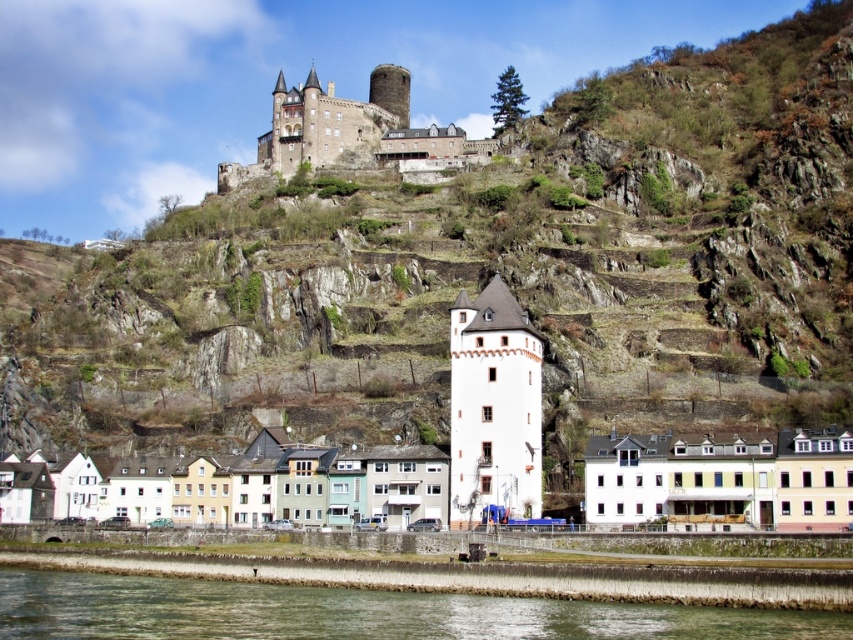
Between clear water at lower center and white matte building at lower center, which one appears on the left side from the viewer's perspective?

Positioned to the left is clear water at lower center.

How much distance is there between clear water at lower center and white matte building at lower center?

17.28 meters

Between point (90, 589) and point (839, 481), which one is positioned in front?

Point (90, 589) is more forward.

What are the coordinates of `clear water at lower center` in the screenshot? It's located at (357, 612).

Can you confirm if white matte building at lower center is wider than stone castle at upper center?

Yes, white matte building at lower center is wider than stone castle at upper center.

The height and width of the screenshot is (640, 853). What do you see at coordinates (721, 480) in the screenshot?
I see `white matte building at lower center` at bounding box center [721, 480].

Between point (670, 484) and point (328, 163), which one is positioned behind?

Positioned behind is point (328, 163).

In order to click on white matte building at lower center in this screenshot , I will do `click(721, 480)`.

Is brown rocky hillside at upper center above clear water at lower center?

Yes.

Can you confirm if brown rocky hillside at upper center is thinner than clear water at lower center?

No, brown rocky hillside at upper center is not thinner than clear water at lower center.

What do you see at coordinates (467, 260) in the screenshot? I see `brown rocky hillside at upper center` at bounding box center [467, 260].

Locate an element on the screen. The height and width of the screenshot is (640, 853). brown rocky hillside at upper center is located at coordinates click(x=467, y=260).